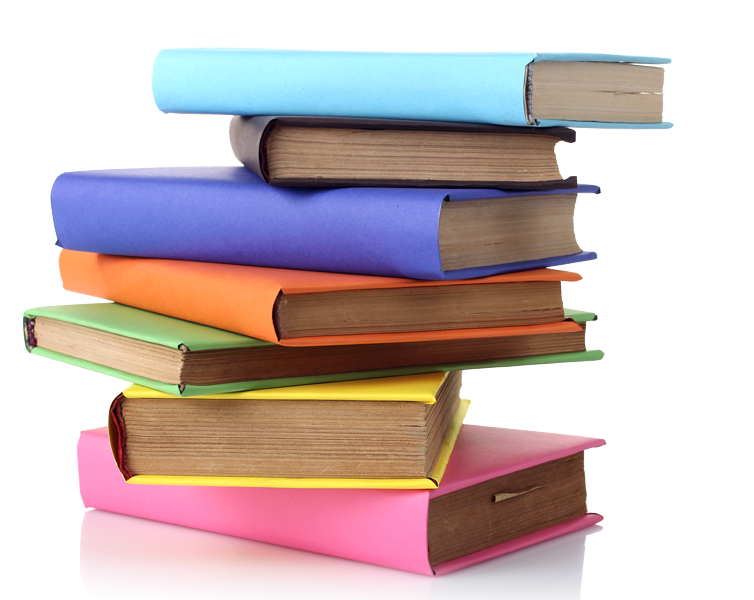
This screenshot has width=754, height=600. Find the location of `book covers`. book covers is located at coordinates (500, 451), (388, 387), (185, 346), (339, 241), (253, 292), (253, 135), (320, 87).